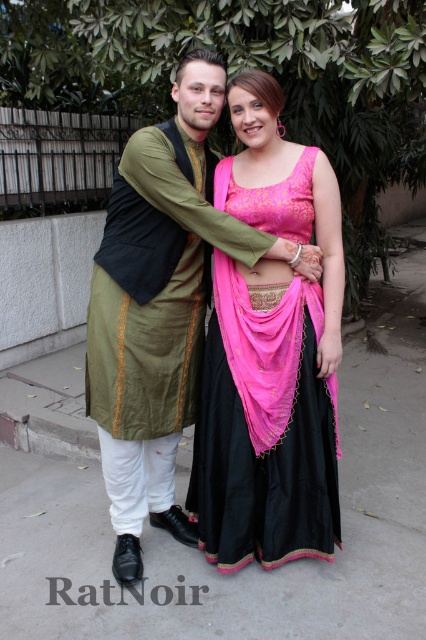
You are a photographer setting up a shoot in this scene. You need to place a 3x3 foot square backdrop behind the two people. The backdrop must be placed on the gray concrete pavement at center or the pink satin lehenga at center. Which surface can accommodate the backdrop without it hanging off the edge?

The gray concrete pavement at center is larger in size than the pink satin lehenga at center, so the backdrop should be placed on the gray concrete pavement at center to ensure it fits without hanging off the edge.

You are standing at the point labeled as point [199,552] in the image. What is the material of the ground beneath your feet?

The point [199,552] indicates gray concrete pavement at center, so the material beneath your feet is concrete.

You are standing in front of the gray concrete pavement at center. If you want to place a 2.5 feet wide decorative stone on the pavement, will it fit entirely on the pavement?

The gray concrete pavement at center is 6.07 feet from viewer. The question about the decorative stone width and pavement size isn not addressed in the provided information. Therefore, it is impossible to determine if it will fit.